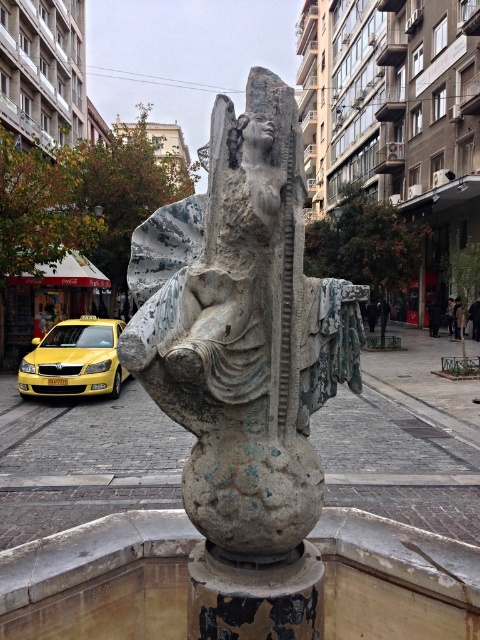
Can you confirm if green patina stone sculpture at center is taller than rusty metallic pillar at center?

Yes, green patina stone sculpture at center is taller than rusty metallic pillar at center.

Is green patina stone sculpture at center bigger than rusty metallic pillar at center?

Correct, green patina stone sculpture at center is larger in size than rusty metallic pillar at center.

The width and height of the screenshot is (480, 640). I want to click on green patina stone sculpture at center, so click(x=242, y=330).

Can you confirm if green patina stone sculpture at center is shorter than yellow metallic taxi at left?

In fact, green patina stone sculpture at center may be taller than yellow metallic taxi at left.

Identify the location of green patina stone sculpture at center. The image size is (480, 640). (242, 330).

Locate an element on the screen. The width and height of the screenshot is (480, 640). green patina stone sculpture at center is located at coordinates (242, 330).

In order to click on green patina stone sculpture at center in this screenshot , I will do `click(242, 330)`.

Who is shorter, rusty metallic pillar at center or yellow metallic taxi at left?

rusty metallic pillar at center

From the picture: Does rusty metallic pillar at center have a greater height compared to yellow metallic taxi at left?

No.

Does point (188, 637) lie behind point (122, 380)?

No, it is not.

Image resolution: width=480 pixels, height=640 pixels. What are the coordinates of `rusty metallic pillar at center` in the screenshot? It's located at (254, 595).